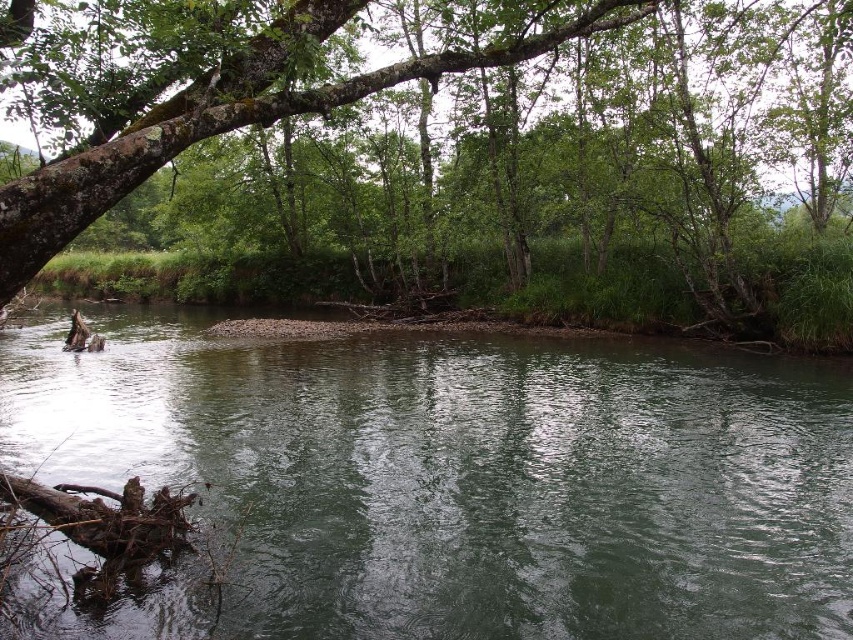
You are standing at the edge of the river and see two points in the scene. The first point is at coordinate point (x=772, y=131) and the second point is at coordinate point (x=413, y=372). Which point is closer to you?

Point (x=772, y=131) is further to the camera than point (x=413, y=372), so the point closer to you is point (x=413, y=372).

You are an environmental scientist assessing the river ecosystem. You notice the green rough bark tree at upper left and the green smooth water at center. Which object is bigger in size?

The green rough bark tree at upper left has a larger size compared to the green smooth water at center.